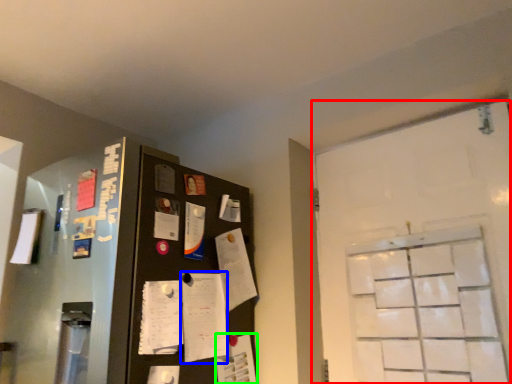
Question: Estimate the real-world distances between objects in this image. Which object is farther from door (highlighted by a red box), notepad (highlighted by a blue box) or paper (highlighted by a green box)?

Choices:
 (A) notepad
 (B) paper

Answer: (A)